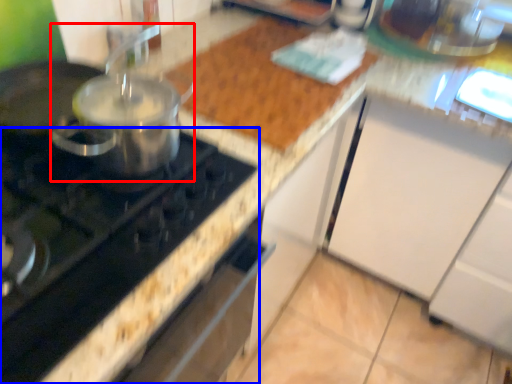
Question: Which point is further to the camera, kitchen appliance (highlighted by a red box) or gas stove (highlighted by a blue box)?

Choices:
 (A) kitchen appliance
 (B) gas stove

Answer: (A)